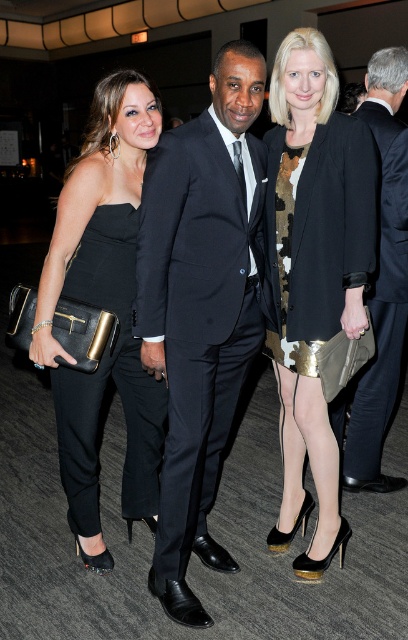
From the picture: Does metallic gold skirt at center have a lesser height compared to satin black suit at center?

Indeed, metallic gold skirt at center has a lesser height compared to satin black suit at center.

The height and width of the screenshot is (640, 408). Describe the element at coordinates (316, 276) in the screenshot. I see `metallic gold skirt at center` at that location.

You are a GUI agent. You are given a task and a screenshot of the screen. Output one action in this format:
    pyautogui.click(x=<x>, y=<y>)
    Task: Click on the metallic gold skirt at center
    
    Given the screenshot: What is the action you would take?
    pyautogui.click(x=316, y=276)

From the picture: Which is above, matte black suit at center or satin black suit at center?

satin black suit at center is above.

Who is more distant from viewer, (x=190, y=189) or (x=370, y=305)?

The point (x=370, y=305) is behind.

What are the coordinates of `matte black suit at center` in the screenshot? It's located at (201, 307).

Who is lower down, matte black suit at center or metallic gold skirt at center?

matte black suit at center is lower down.

How far apart are matte black suit at center and metallic gold skirt at center?

They are 14.45 inches apart.

Identify the location of matte black suit at center. The image size is (408, 640). (201, 307).

At what (x,y) coordinates should I click in order to perform the action: click on matte black suit at center. Please return your answer as a coordinate pair (x, y). Looking at the image, I should click on (201, 307).